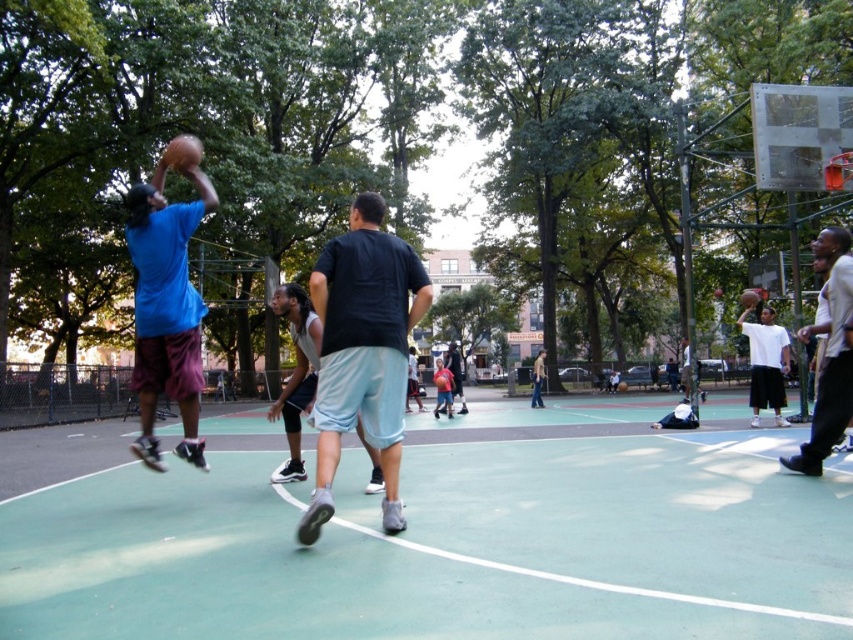
You are a referee watching the basketball game. You notice the white matte shirt at right and the glossy rubber basketball at upper center. Which object is closer to the front of the scene?

The white matte shirt at right is closer to the front of the scene because the glossy rubber basketball at upper center is behind it.

You are a photographer positioned at the center of the basketball court. You want to take a photo that includes both the white matte shirt at right and the glossy rubber basketball at upper center. Which object should you adjust your camera angle to focus on first if you want to capture both in the frame without zooming in or out?

The white matte shirt at right has a lesser width compared to the glossy rubber basketball at upper center, so you should focus on the glossy rubber basketball at upper center first to ensure it fits within the frame.

You are a photographer positioned at the edge of the basketball court. You notice two players wearing light gray shorts at center and matte blue shorts at center. Which player is jumping higher during the game?

The light gray shorts at center is above matte blue shorts at center, so the player wearing light gray shorts at center is jumping higher.